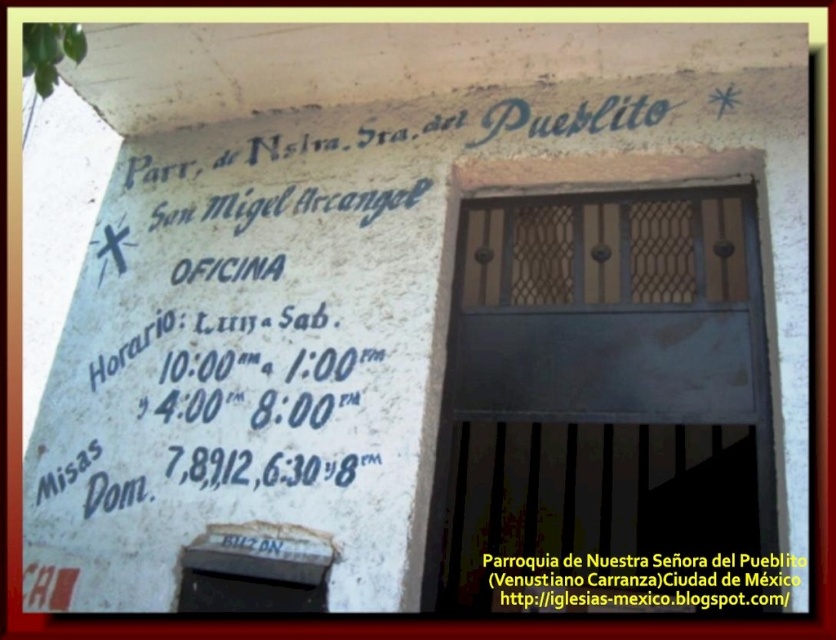
You are a tourist visiting this historic site and need to enter the office. You see the dark gray metal door at center and the white painted text at upper center. Which one is bigger in size?

The dark gray metal door at center has a larger size compared to the white painted text at upper center, so the dark gray metal door at center is bigger in size.

You are standing in front of the building with the stone wall and door. There are two points marked on the wall at coordinates point (575, 604). How far apart are these two points?

The two points marked on the wall are 8.64 feet apart.

What is the color of the door represented by the point at coordinates (600, 401)?

The dark gray metal door at center is represented by point (600, 401), so the color is dark gray.